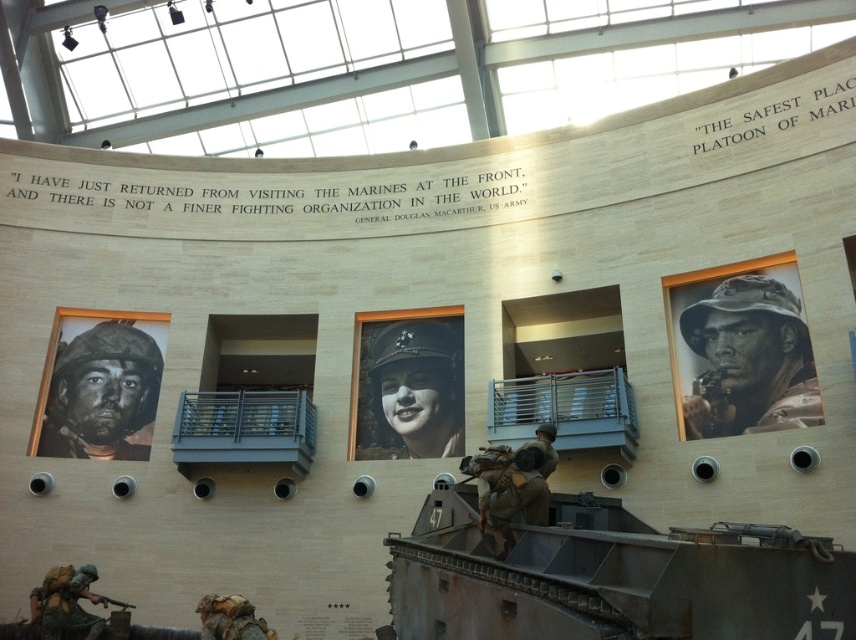
Is point (723, 396) positioned after point (103, 602)?

That is True.

Which is above, black matte helmet at right or matte black rifle at lower left?

Positioned higher is black matte helmet at right.

Measure the distance between black matte helmet at right and camera.

The distance of black matte helmet at right from camera is 45.51 meters.

The height and width of the screenshot is (640, 856). I want to click on black matte helmet at right, so click(x=749, y=360).

Who is shorter, black matte helmet at left or matte bronze soldier at lower left?

matte bronze soldier at lower left

In the scene shown: Can you confirm if black matte helmet at left is shorter than matte bronze soldier at lower left?

Incorrect, black matte helmet at left's height does not fall short of matte bronze soldier at lower left's.

Is point (52, 429) in front of point (90, 637)?

That is False.

What are the coordinates of `black matte helmet at left` in the screenshot? It's located at click(100, 394).

Does point (752, 432) lie behind point (97, 456)?

No.

Can you confirm if black matte helmet at right is bigger than black matte helmet at left?

Yes, black matte helmet at right is bigger than black matte helmet at left.

Between point (729, 410) and point (87, 420), which one is positioned in front?

Point (729, 410)

What are the coordinates of `black matte helmet at right` in the screenshot? It's located at (749, 360).